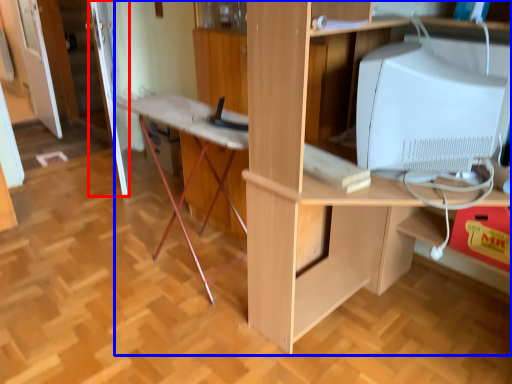
Question: Which of the following is the farthest to the observer, door (highlighted by a red box) or desk (highlighted by a blue box)?

Choices:
 (A) door
 (B) desk

Answer: (A)